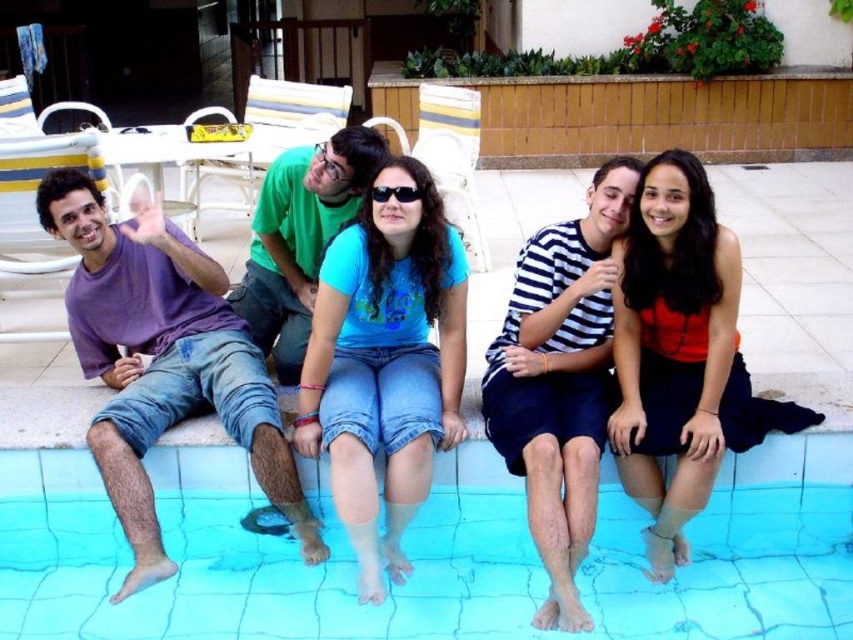
Question: Is striped cotton shirt at center positioned in front of black plastic sunglasses at center?

Choices:
 (A) no
 (B) yes

Answer: (B)

Question: Considering the real-world distances, which object is closest to the blue tile swimming pool at lower center?

Choices:
 (A) black plastic sunglasses at center
 (B) striped cotton shirt at center

Answer: (B)

Question: Is blue tile swimming pool at lower center wider than striped cotton shirt at center?

Choices:
 (A) yes
 (B) no

Answer: (A)

Question: Which object is the closest to the purple cotton t-shirt at left?

Choices:
 (A) blue matte shirt at center
 (B) striped cotton shirt at center

Answer: (A)

Question: Can you confirm if blue tile swimming pool at lower center is positioned to the right of black plastic sunglasses at center?

Choices:
 (A) yes
 (B) no

Answer: (A)

Question: Which point is farther to the camera?

Choices:
 (A) (403, 196)
 (B) (410, 385)

Answer: (B)